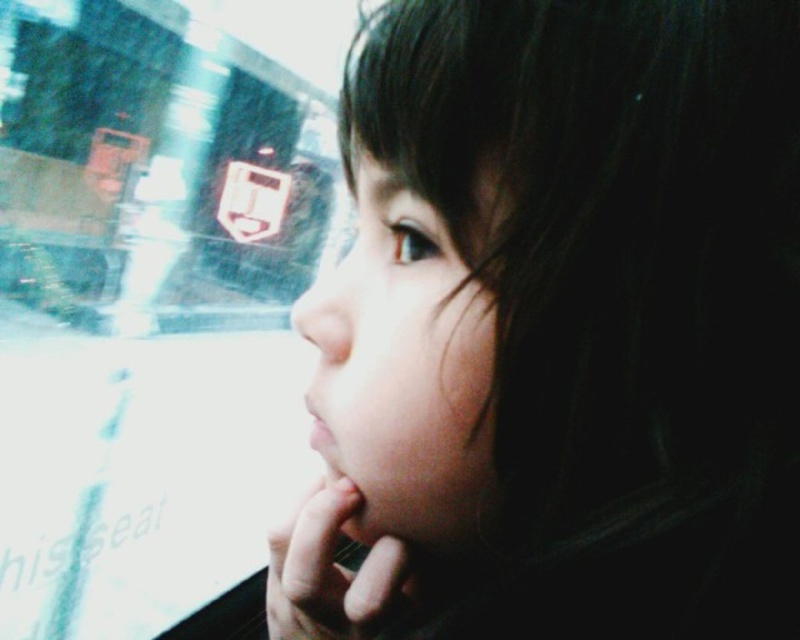
You are a photographer adjusting your camera settings. You notice a point at coordinates point (x=558, y=330) in the image. What object is located at that point?

The point (x=558, y=330) is where dark hair at upper right is located.

You are an artist trying to sketch this scene. You need to determine which of the two points, point (572, 81) or point (88, 218), is closer to the viewer to create depth in your drawing. Based on the image, which point should you emphasize as being nearer?

Point (572, 81) is closer to the viewer than point (88, 218), so you should emphasize point (572, 81) as being nearer in your drawing.